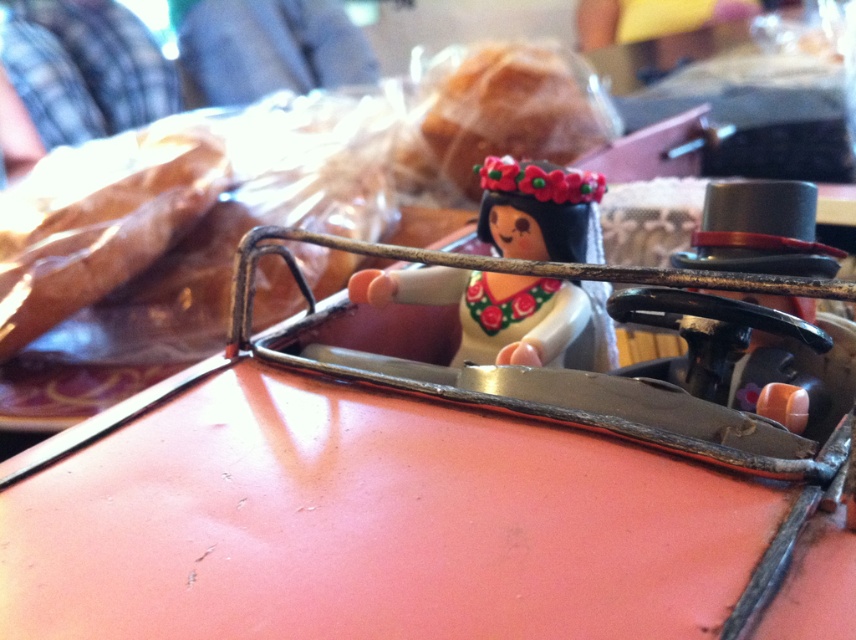
Consider the image. You are a delivery robot trying to place a matte plastic bread at upper center onto a shelf that can only hold items within 20 inches from the matte plastic doll at center. Can you safely place the bread there?

The matte plastic bread at upper center is 21.20 inches away from the matte plastic doll at center, which exceeds the shelf limit of 20 inches. Therefore, you cannot safely place the bread there.

You have a small box that is exactly the same width as the matte plastic doll at center. If you want to place the matte orange toy car at center into the box, will it fit? Please explain your reasoning based on their widths.

The matte orange toy car at center is wider than the matte plastic doll at center. Since the box is the same width as the doll, the car will not fit inside the box because it is wider than the doll.